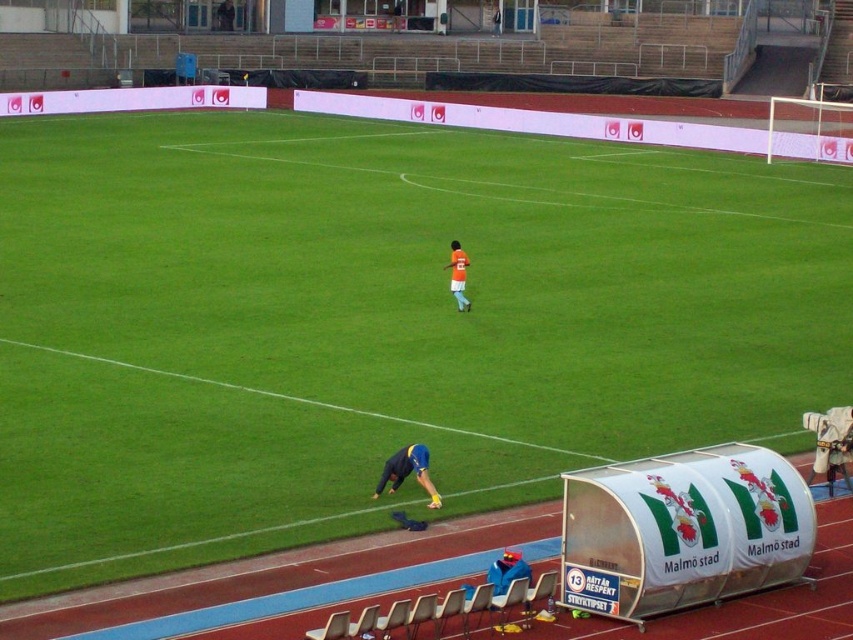
You are a photographer positioned at the edge of the soccer field. You want to capture a photo that includes both the blue fabric at lower center and the orange jersey at center. Which object should be placed to the left side of the photo frame to include both?

The blue fabric at lower center should be placed to the left side of the photo frame since it is already positioned to the left of the orange jersey at center, allowing both to be included in the photo.